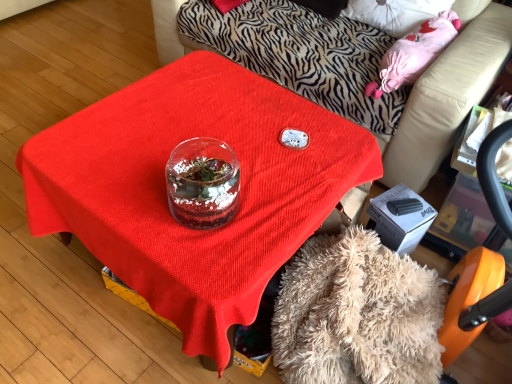
Question: Does fuzzy beige blanket at lower center have a lesser height compared to transparent glass jar at center?

Choices:
 (A) yes
 (B) no

Answer: (A)

Question: Can you confirm if fuzzy beige blanket at lower center is smaller than transparent glass jar at center?

Choices:
 (A) no
 (B) yes

Answer: (B)

Question: Is fuzzy beige blanket at lower center bigger than transparent glass jar at center?

Choices:
 (A) yes
 (B) no

Answer: (B)

Question: From the image's perspective, would you say fuzzy beige blanket at lower center is shown under transparent glass jar at center?

Choices:
 (A) no
 (B) yes

Answer: (B)

Question: Does fuzzy beige blanket at lower center appear on the right side of transparent glass jar at center?

Choices:
 (A) no
 (B) yes

Answer: (A)

Question: From a real-world perspective, relative to transparent glass jar at center, is fuzzy beige blanket at lower center vertically above or below?

Choices:
 (A) below
 (B) above

Answer: (A)

Question: Is fuzzy beige blanket at lower center inside the boundaries of transparent glass jar at center, or outside?

Choices:
 (A) outside
 (B) inside

Answer: (A)

Question: Is fuzzy beige blanket at lower center wider or thinner than transparent glass jar at center?

Choices:
 (A) thin
 (B) wide

Answer: (A)

Question: From the image's perspective, is fuzzy beige blanket at lower center located above or below transparent glass jar at center?

Choices:
 (A) below
 (B) above

Answer: (A)

Question: From the image's perspective, relative to fuzzy beige blanket at lower center, is transparent glass jar at center above or below?

Choices:
 (A) above
 (B) below

Answer: (A)

Question: In the image, is transparent glass jar at center on the left side or the right side of fuzzy beige blanket at lower center?

Choices:
 (A) right
 (B) left

Answer: (A)

Question: Looking at the image, does transparent glass jar at center seem bigger or smaller compared to fuzzy beige blanket at lower center?

Choices:
 (A) small
 (B) big

Answer: (B)

Question: Considering the positions of point (408, 105) and point (352, 377), is point (408, 105) closer or farther from the camera than point (352, 377)?

Choices:
 (A) closer
 (B) farther

Answer: (B)

Question: Is transparent glass terrarium at center bigger or smaller than fuzzy beige blanket at lower center?

Choices:
 (A) big
 (B) small

Answer: (A)

Question: Considering the relative positions of transparent glass terrarium at center and fuzzy beige blanket at lower center in the image provided, is transparent glass terrarium at center to the left or to the right of fuzzy beige blanket at lower center?

Choices:
 (A) right
 (B) left

Answer: (B)